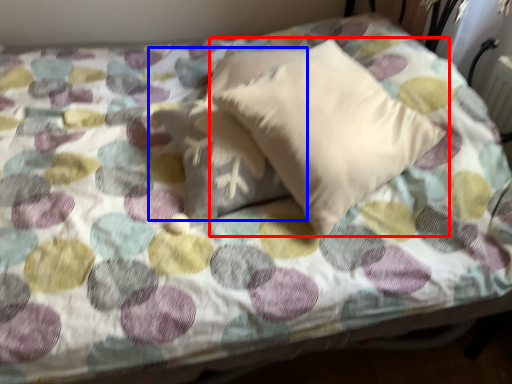
Question: Which object is closer to the camera taking this photo, pillow (highlighted by a red box) or pillow (highlighted by a blue box)?

Choices:
 (A) pillow
 (B) pillow

Answer: (A)